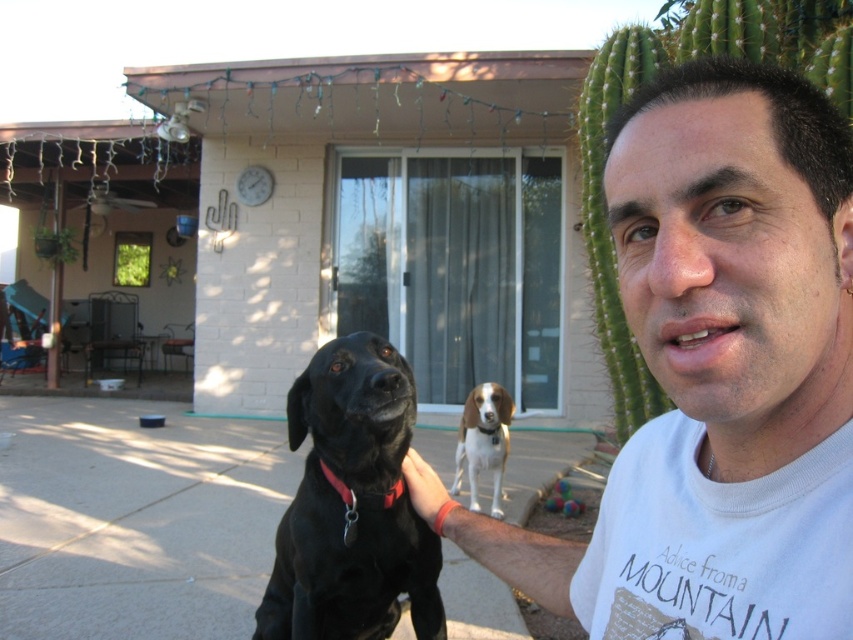
Is matte white t-shirt at center to the right of shiny black dog at center from the viewer's perspective?

Yes, matte white t-shirt at center is to the right of shiny black dog at center.

This screenshot has height=640, width=853. What are the coordinates of `matte white t-shirt at center` in the screenshot? It's located at 714,376.

Does green spiny cactus at right have a smaller size compared to brown and white fur dog at center?

No, green spiny cactus at right is not smaller than brown and white fur dog at center.

Looking at this image, is green spiny cactus at right to the right of brown and white fur dog at center from the viewer's perspective?

Indeed, green spiny cactus at right is positioned on the right side of brown and white fur dog at center.

Is point (589, 192) closer to viewer compared to point (486, 403)?

Yes.

Where is `green spiny cactus at right`? green spiny cactus at right is located at coordinates (631, 96).

Does point (653, 230) come closer to viewer compared to point (498, 429)?

Yes, point (653, 230) is in front of point (498, 429).

Who is positioned more to the right, matte white t-shirt at center or brown and white fur dog at center?

brown and white fur dog at center is more to the right.

The image size is (853, 640). I want to click on matte white t-shirt at center, so click(714, 376).

Locate an element on the screen. This screenshot has width=853, height=640. matte white t-shirt at center is located at coordinates (714, 376).